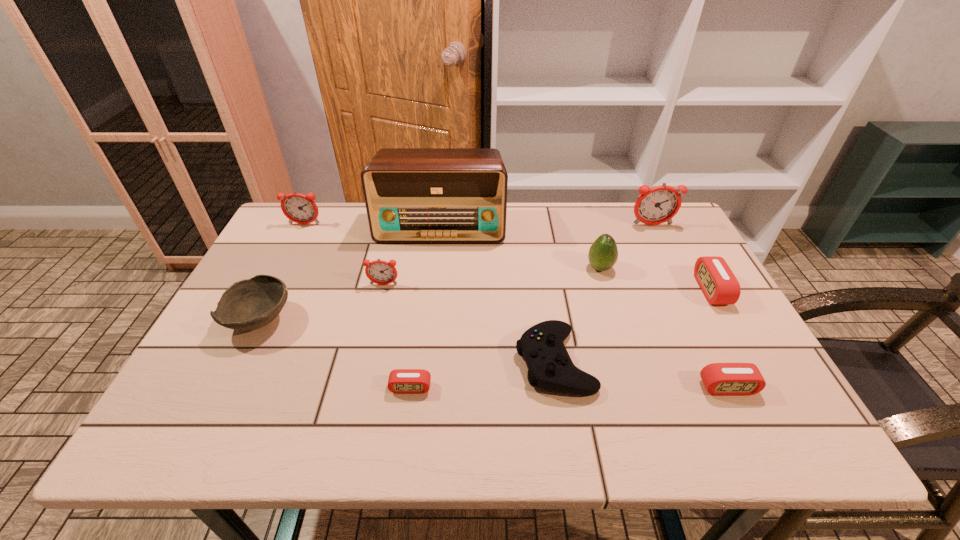
You are a GUI agent. You are given a task and a screenshot of the screen. Output one action in this format:
    pyautogui.click(x=<x>, y=<y>)
    Task: Click on the free point between the bowl and the second biggest pink alarm clock
    Image resolution: width=960 pixels, height=540 pixels.
    Given the screenshot: What is the action you would take?
    pyautogui.click(x=494, y=354)

I want to click on free space that is in between the ninth shortest object and the farthest pink alarm clock, so click(x=682, y=258).

Where is `blank region between the shortest object and the avocado`? blank region between the shortest object and the avocado is located at coordinates (505, 328).

At what (x,y) coordinates should I click in order to perform the action: click on free area in between the second smallest pink alarm clock and the leftmost reddish-pink alarm clock. Please return your answer as a coordinate pair (x, y). The image size is (960, 540). Looking at the image, I should click on [x=516, y=306].

This screenshot has height=540, width=960. Identify the location of free space that is in between the second biggest reddish-pink alarm clock and the third shortest alarm clock. (508, 257).

Find the location of a particular element. The image size is (960, 540). free space between the bowl and the farthest pink alarm clock is located at coordinates (486, 305).

In order to click on blank region between the fourth alarm clock from right to left and the bowl in this screenshot , I will do `click(335, 354)`.

Image resolution: width=960 pixels, height=540 pixels. What are the coordinates of `object that is the sixth closest one to the radio receiver` in the screenshot? It's located at (659, 204).

Image resolution: width=960 pixels, height=540 pixels. What are the coordinates of `object that ranks as the fourth closest to the shortest object` in the screenshot? It's located at (412, 195).

Where is `alarm clock that can be found as the third closest to the fourth shortest alarm clock`? The width and height of the screenshot is (960, 540). alarm clock that can be found as the third closest to the fourth shortest alarm clock is located at coordinates (659, 204).